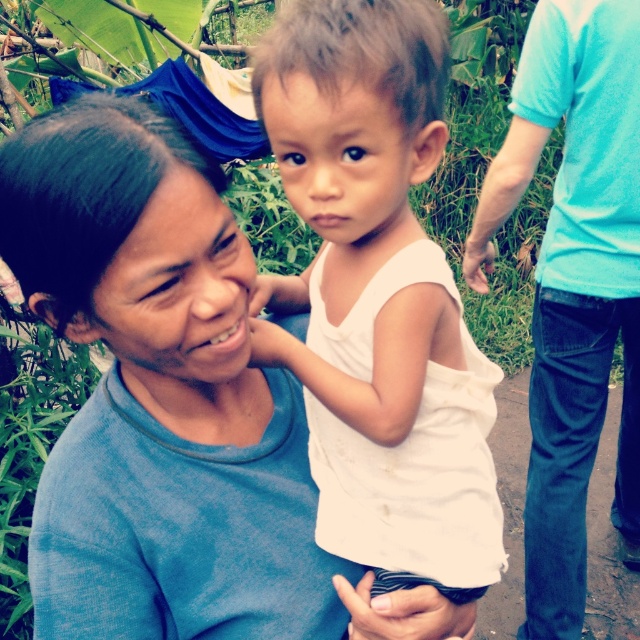
Is white cotton shirt at center positioned in front of light blue t-shirt at right?

Yes, it is in front of light blue t-shirt at right.

Who is higher up, white cotton shirt at center or light blue t-shirt at right?

Positioned higher is white cotton shirt at center.

Between point (333, 390) and point (547, 236), which one is positioned in front?

Point (333, 390) is more forward.

In order to click on white cotton shirt at center in this screenshot , I will do coord(378,298).